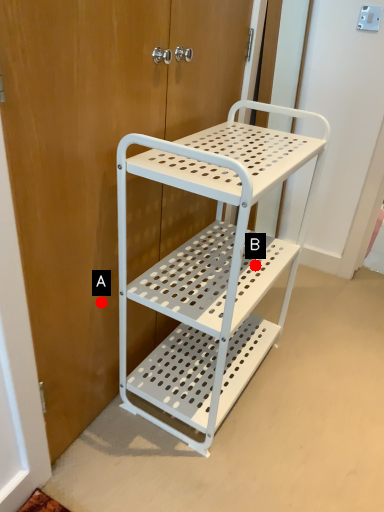
Question: Two points are circled on the image, labeled by A and B beside each circle. Which point is farther from the camera taking this photo?

Choices:
 (A) A is further
 (B) B is further

Answer: (B)